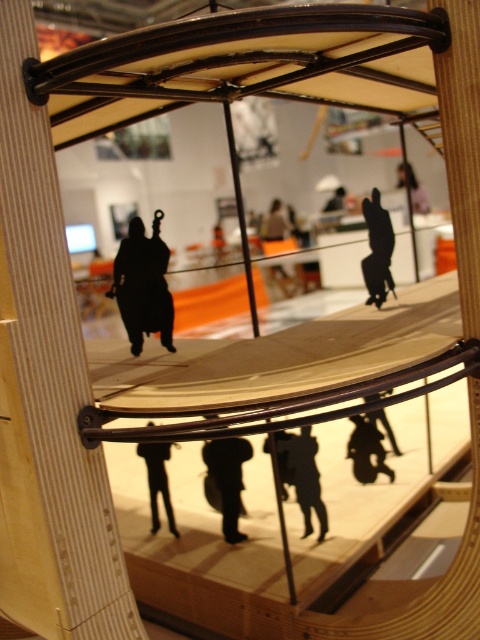
You are an interior designer assessing the placement of two black matte items in the image. The items are the black matte figure at upper right and the black matte pants at center. Based on their thickness, which item would require more space when arranging them side by side?

The black matte pants at center are thicker than the black matte figure at upper right, so arranging them side by side would require more space for the black matte pants at center.

You are standing in front of the curved wooden structure and notice the wooden figure at center and the black matte motorcycle at lower center. Which object is positioned lower in the scene?

The wooden figure at center is positioned below the black matte motorcycle at lower center, so the wooden figure at center is lower.